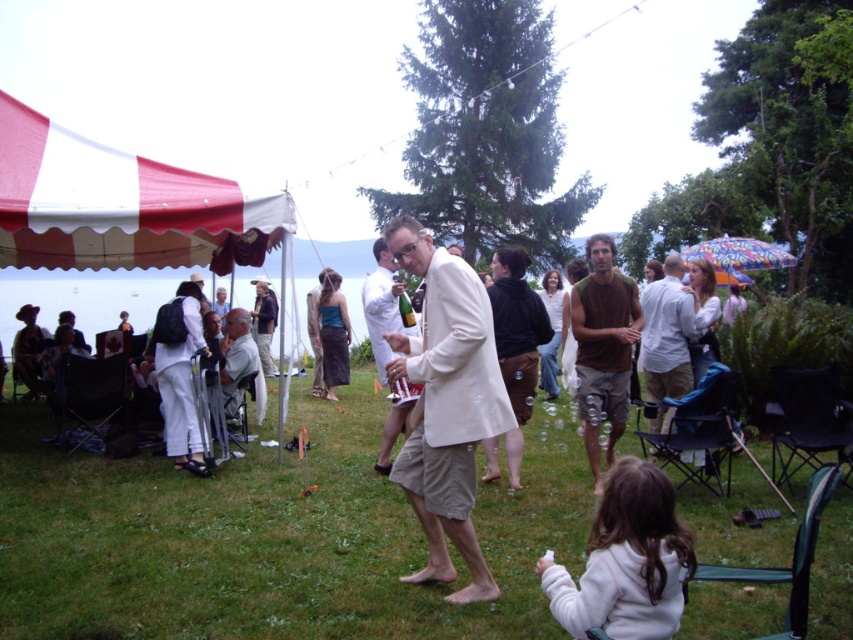
You are a photographer at the event and need to ensure both the light beige fabric jacket at center and the light gray suit at center are visible in the frame. Given their height difference, which one might you position closer to the camera to balance their visibility?

The light beige fabric jacket at center is much taller than the light gray suit at center, so positioning the light gray suit at center closer to the camera would help balance their visibility.

You are standing at the point marked by coordinates (267, 538) in the image. What is the terrain like at that location?

The point at coordinates (267, 538) is green grass at center, indicating a grassy terrain.

You are standing at the edge of the grassy area and want to walk to the white fleece jacket at lower right. Which direction should you move relative to the green grass at center?

You should move away from the green grass at center because the white fleece jacket at lower right is behind it, farther from the viewer.